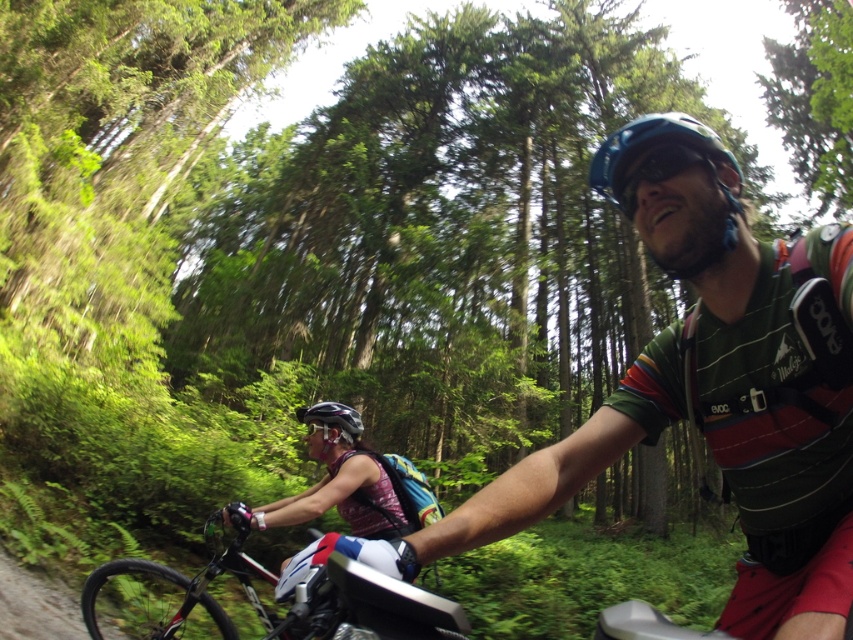
You are a cyclist trying to overtake the person ahead of you on a forest trail. You see a shiny metallic bike at center and a matte black helmet at lower center. Which object should you focus on to determine your position relative to the other cyclist?

You should focus on the shiny metallic bike at center because it is to the left of the matte black helmet at lower center, indicating its position relative to the cyclist wearing the matte black helmet.